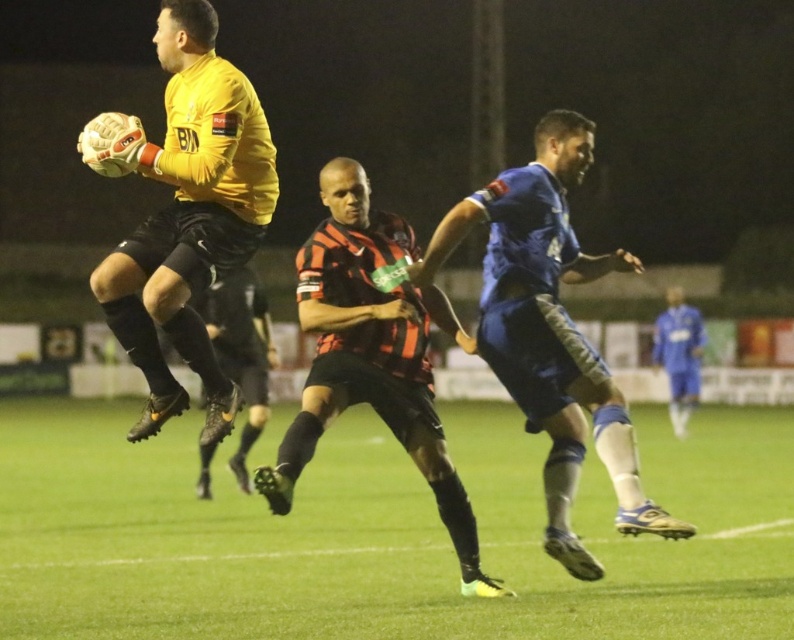
Question: Can you confirm if green grass at center is bigger than matte yellow jersey at upper left?

Choices:
 (A) no
 (B) yes

Answer: (B)

Question: Is blue fabric shorts at center smaller than matte yellow jersey at upper left?

Choices:
 (A) no
 (B) yes

Answer: (B)

Question: Which point is closer to the camera taking this photo?

Choices:
 (A) (218, 83)
 (B) (259, 362)
 (C) (210, 532)

Answer: (A)

Question: Which object is closer to the camera taking this photo?

Choices:
 (A) green grass at center
 (B) blue fabric shorts at center
 (C) black and red striped jersey at center

Answer: (A)

Question: Can you confirm if green grass at center is positioned below blue fabric shorts at center?

Choices:
 (A) no
 (B) yes

Answer: (B)

Question: Which object is closer to the camera taking this photo?

Choices:
 (A) blue fabric shorts at center
 (B) black matte soccer cleat at center

Answer: (A)